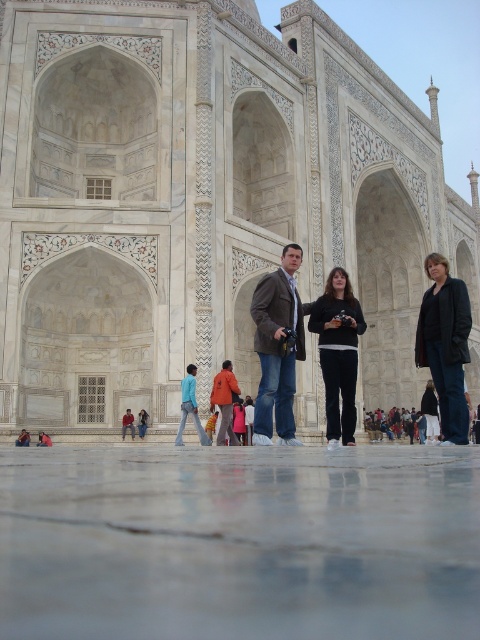
In the scene shown: You are a tourist standing in front of the Taj Mahal. You see the white marble palace at center and the blue denim jeans at center. Which object is closer to you?

The white marble palace at center is closer to you than the blue denim jeans at center.

You are standing in front of the Taj Mahal and notice an orange fabric coat at center. If you want to place a small statue exactly where the orange fabric coat is currently positioned, would the statue be placed on the reflective ground surface or on the building facade?

The orange fabric coat at center is located at point (225, 401), which is on the reflective ground surface in the foreground. Therefore, placing the statue there would position it on the reflective ground surface.

You are a photographer planning to capture a photo of the Taj Mahal with the orange fabric coat at center and blue denim jeans at center in the foreground. Since the reflective ground surface is present, you want to ensure that both items are fully visible in their reflections. Which item will have a shorter reflection on the reflective ground?

The orange fabric coat at center will have a shorter reflection on the reflective ground because it is shorter than the blue denim jeans at center.